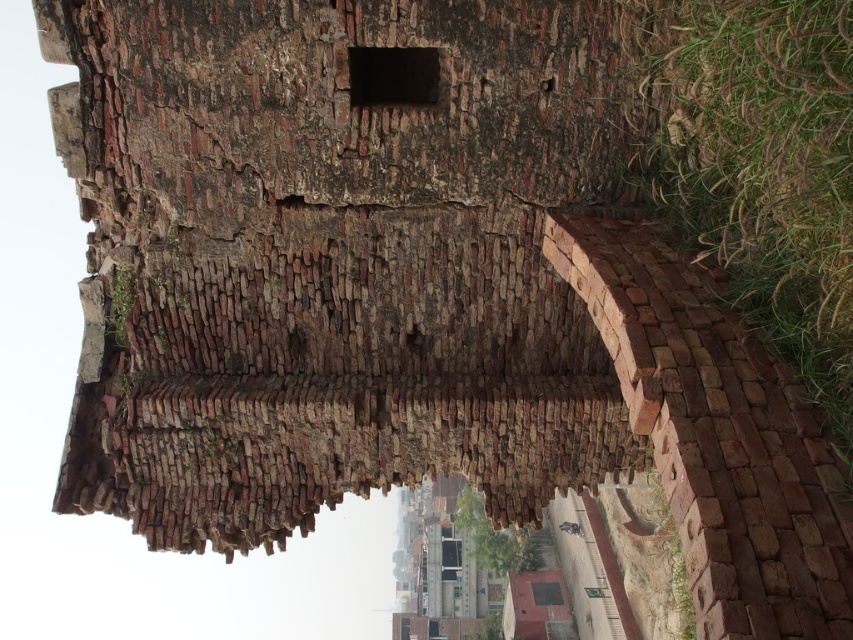
Question: Which of these objects is positioned farthest from the rustic brick hut at center?

Choices:
 (A) green rough grass at right
 (B) dark gray stone hole at center

Answer: (A)

Question: Among these points, which one is farthest from the camera?

Choices:
 (A) (422, 84)
 (B) (727, 164)

Answer: (A)

Question: Does green rough grass at right have a larger size compared to rustic brick hut at center?

Choices:
 (A) no
 (B) yes

Answer: (A)

Question: Does green rough grass at right have a smaller size compared to dark gray stone hole at center?

Choices:
 (A) no
 (B) yes

Answer: (A)

Question: Which of the following is the closest to the observer?

Choices:
 (A) dark gray stone hole at center
 (B) green rough grass at right

Answer: (B)

Question: Considering the relative positions of dark gray stone hole at center and rustic brick hut at center in the image provided, where is dark gray stone hole at center located with respect to rustic brick hut at center?

Choices:
 (A) above
 (B) below

Answer: (A)